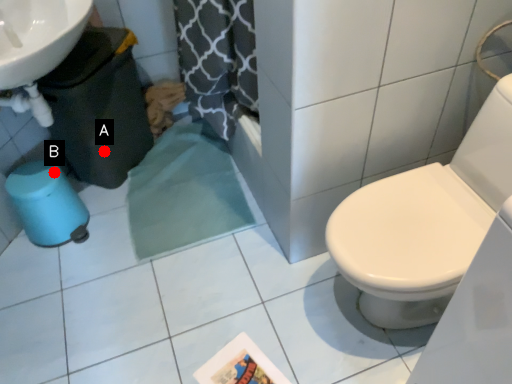
Question: Two points are circled on the image, labeled by A and B beside each circle. Which of the following is the farthest from the observer?

Choices:
 (A) A is further
 (B) B is further

Answer: (A)